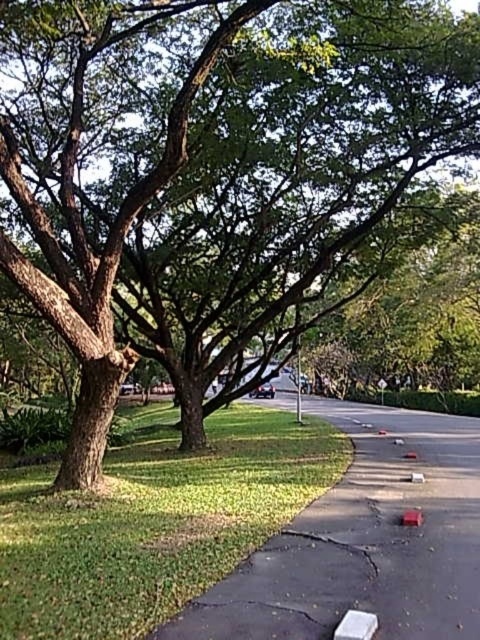
Question: Which point appears closest to the camera in this image?

Choices:
 (A) tap(121, 500)
 (B) tap(369, 406)

Answer: (A)

Question: Which point is closer to the camera?

Choices:
 (A) (7, 547)
 (B) (396, 502)

Answer: (A)

Question: Can you confirm if green grass at lower left is positioned above smooth asphalt sidewalk at lower center?

Choices:
 (A) no
 (B) yes

Answer: (A)

Question: Does green grass at lower left appear under smooth asphalt sidewalk at lower center?

Choices:
 (A) yes
 (B) no

Answer: (A)

Question: Does green grass at lower left lie behind smooth asphalt sidewalk at lower center?

Choices:
 (A) no
 (B) yes

Answer: (B)